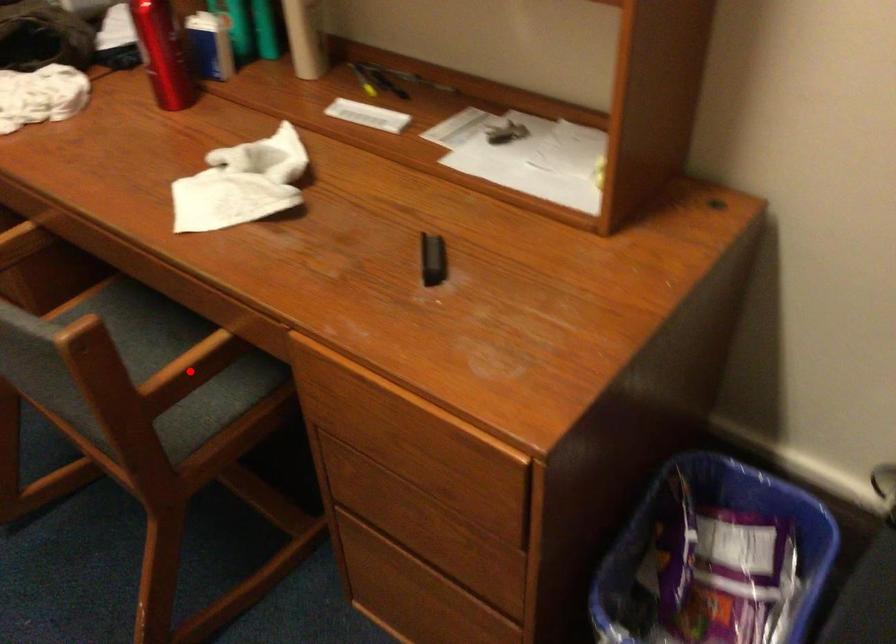
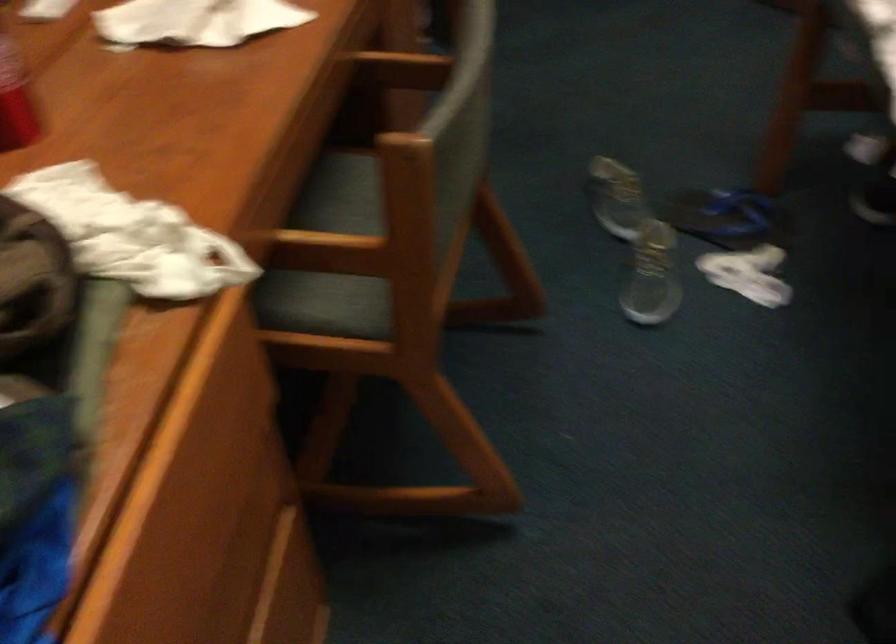
Locate, in the second image, the point that corresponds to the highlighted location in the first image.

(401, 69)